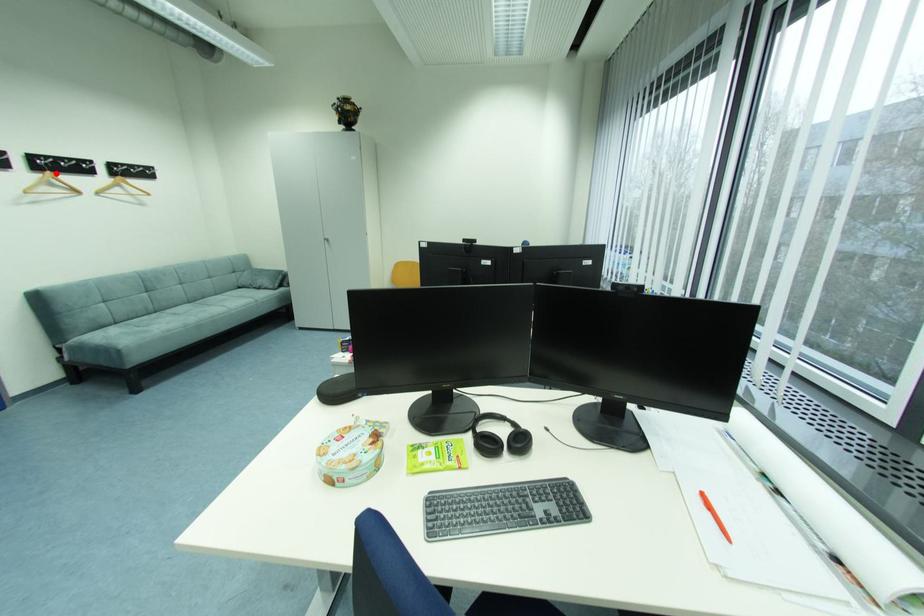
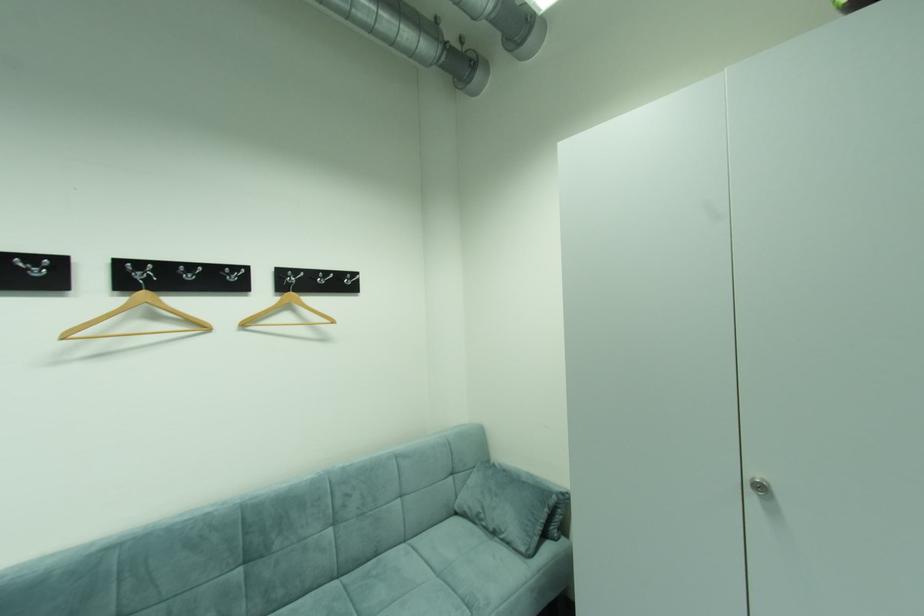
Locate, in the second image, the point that corresponds to the highlighted location in the first image.

(150, 294)